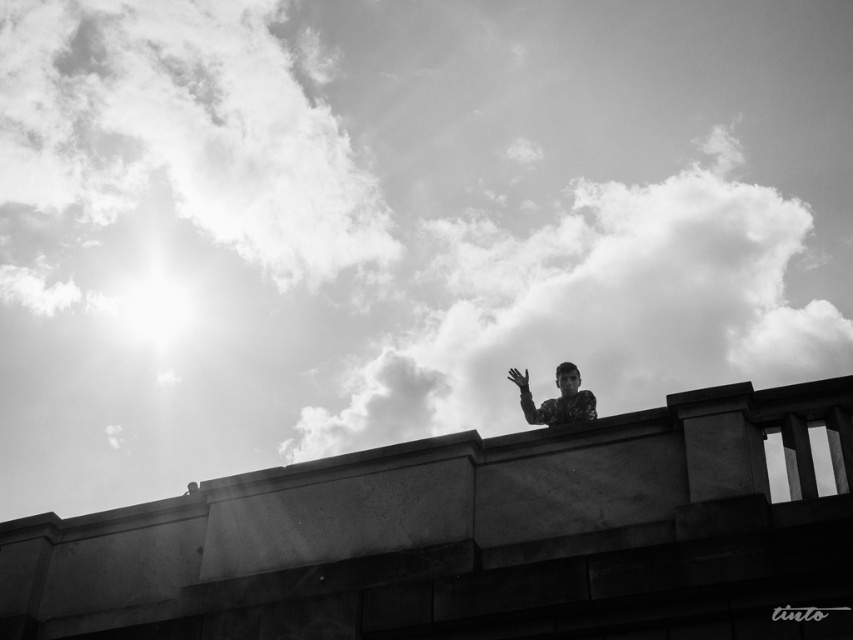
Between camouflage fabric person at upper center and matte black hand at upper center, which one has more height?

Standing taller between the two is camouflage fabric person at upper center.

Who is lower down, camouflage fabric person at upper center or matte black hand at upper center?

camouflage fabric person at upper center

Identify the location of camouflage fabric person at upper center. (556, 397).

Locate an element on the screen. camouflage fabric person at upper center is located at coordinates (556, 397).